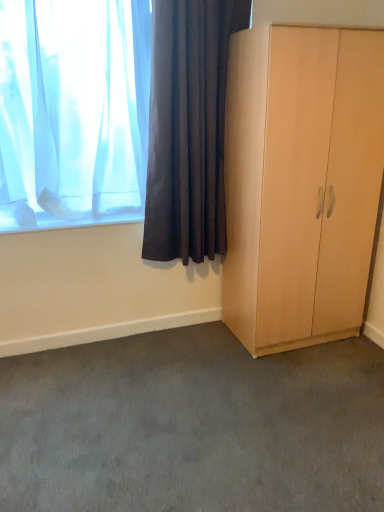
Image resolution: width=384 pixels, height=512 pixels. What are the coordinates of `translucent fabric curtain at upper left, which is the 2th curtain in right-to-left order` in the screenshot? It's located at (73, 111).

You are a GUI agent. You are given a task and a screenshot of the screen. Output one action in this format:
    pyautogui.click(x=<x>, y=<y>)
    Task: Click on the dark fabric curtain at upper left, which appears as the first curtain when viewed from the right
    The image size is (384, 512).
    Given the screenshot: What is the action you would take?
    pyautogui.click(x=188, y=128)

The height and width of the screenshot is (512, 384). In order to click on light wood wardrobe at right in this screenshot , I will do `click(301, 182)`.

Where is `translucent fabric curtain at upper left, positioned as the 1th curtain in left-to-right order`? The width and height of the screenshot is (384, 512). translucent fabric curtain at upper left, positioned as the 1th curtain in left-to-right order is located at coordinates (73, 111).

From a real-world perspective, is gray carpet at lower center positioned under light wood wardrobe at right based on gravity?

Yes, from a real-world perspective, gray carpet at lower center is beneath light wood wardrobe at right.

Can you confirm if gray carpet at lower center is bigger than light wood wardrobe at right?

Actually, gray carpet at lower center might be smaller than light wood wardrobe at right.

Consider the image. Does gray carpet at lower center turn towards light wood wardrobe at right?

No, gray carpet at lower center is not aimed at light wood wardrobe at right.

Considering the positions of points (110, 79) and (193, 105), is point (110, 79) closer to camera compared to point (193, 105)?

No, it is behind (193, 105).

Can you confirm if translucent fabric curtain at upper left, positioned as the 1th curtain in left-to-right order, is positioned to the right of dark fabric curtain at upper left, which appears as the first curtain when viewed from the right?

Incorrect, translucent fabric curtain at upper left, positioned as the 1th curtain in left-to-right order, is not on the right side of dark fabric curtain at upper left, which appears as the first curtain when viewed from the right.

From a real-world perspective, is translucent fabric curtain at upper left, which is the 2th curtain in right-to-left order, above or below dark fabric curtain at upper left, which appears as the first curtain when viewed from the right?

translucent fabric curtain at upper left, which is the 2th curtain in right-to-left order, is above dark fabric curtain at upper left, which appears as the first curtain when viewed from the right.

Would you say dark fabric curtain at upper left, which appears as the first curtain when viewed from the right, is part of translucent fabric curtain at upper left, positioned as the 1th curtain in left-to-right order,'s contents?

No, dark fabric curtain at upper left, which appears as the first curtain when viewed from the right, is not a part of translucent fabric curtain at upper left, positioned as the 1th curtain in left-to-right order.

From the image's perspective, is dark fabric curtain at upper left, which appears as the first curtain when viewed from the right, located above or below light wood wardrobe at right?

Based on their image positions, dark fabric curtain at upper left, which appears as the first curtain when viewed from the right, is located above light wood wardrobe at right.

Considering the positions of point (163, 169) and point (314, 74), is point (163, 169) closer or farther from the camera than point (314, 74)?

Clearly, point (163, 169) is more distant from the camera than point (314, 74).

Is dark fabric curtain at upper left, which appears as the first curtain when viewed from the right, not close to light wood wardrobe at right?

Actually, dark fabric curtain at upper left, which appears as the first curtain when viewed from the right, and light wood wardrobe at right are a little close together.

Can you confirm if translucent fabric curtain at upper left, positioned as the 1th curtain in left-to-right order, is positioned to the right of light wood wardrobe at right?

In fact, translucent fabric curtain at upper left, positioned as the 1th curtain in left-to-right order, is to the left of light wood wardrobe at right.

Are translucent fabric curtain at upper left, positioned as the 1th curtain in left-to-right order, and light wood wardrobe at right located far from each other?

That's not correct — translucent fabric curtain at upper left, positioned as the 1th curtain in left-to-right order, is a little close to light wood wardrobe at right.

From the picture: Can you confirm if translucent fabric curtain at upper left, positioned as the 1th curtain in left-to-right order, is thinner than light wood wardrobe at right?

Correct, the width of translucent fabric curtain at upper left, positioned as the 1th curtain in left-to-right order, is less than that of light wood wardrobe at right.

How many degrees apart are the facing directions of translucent fabric curtain at upper left, positioned as the 1th curtain in left-to-right order, and light wood wardrobe at right?

1.42 degrees separate the facing orientations of translucent fabric curtain at upper left, positioned as the 1th curtain in left-to-right order, and light wood wardrobe at right.

In the scene shown: Measure the distance from light wood wardrobe at right to dark fabric curtain at upper left, the second curtain in the left-to-right sequence.

light wood wardrobe at right is 17.49 inches from dark fabric curtain at upper left, the second curtain in the left-to-right sequence.

Can you confirm if light wood wardrobe at right is shorter than dark fabric curtain at upper left, which appears as the first curtain when viewed from the right?

No.

Looking at this image, could you tell me if light wood wardrobe at right is facing dark fabric curtain at upper left, which appears as the first curtain when viewed from the right?

No.

Does light wood wardrobe at right come behind dark fabric curtain at upper left, the second curtain in the left-to-right sequence?

No, it is in front of dark fabric curtain at upper left, the second curtain in the left-to-right sequence.

Which point is more forward, (345, 33) or (90, 22)?

Positioned in front is point (345, 33).

Consider the image. From the image's perspective, which is below, light wood wardrobe at right or translucent fabric curtain at upper left, positioned as the 1th curtain in left-to-right order?

From the image's view, light wood wardrobe at right is below.

Does light wood wardrobe at right turn towards translucent fabric curtain at upper left, which is the 2th curtain in right-to-left order?

No, light wood wardrobe at right does not turn towards translucent fabric curtain at upper left, which is the 2th curtain in right-to-left order.

Considering the relative sizes of light wood wardrobe at right and translucent fabric curtain at upper left, which is the 2th curtain in right-to-left order, in the image provided, is light wood wardrobe at right shorter than translucent fabric curtain at upper left, which is the 2th curtain in right-to-left order,?

In fact, light wood wardrobe at right may be taller than translucent fabric curtain at upper left, which is the 2th curtain in right-to-left order.

I want to click on plain below the dark fabric curtain at upper left, the second curtain in the left-to-right sequence (from the image's perspective), so point(193,426).

From the picture: From a real-world perspective, which is physically below, dark fabric curtain at upper left, the second curtain in the left-to-right sequence, or gray carpet at lower center?

From a 3D spatial view, gray carpet at lower center is below.

Between dark fabric curtain at upper left, the second curtain in the left-to-right sequence, and gray carpet at lower center, which one is positioned behind?

Positioned behind is dark fabric curtain at upper left, the second curtain in the left-to-right sequence.

This screenshot has height=512, width=384. What are the coordinates of `plain in front of the light wood wardrobe at right` in the screenshot? It's located at (193, 426).

You are a GUI agent. You are given a task and a screenshot of the screen. Output one action in this format:
    pyautogui.click(x=<x>, y=<y>)
    Task: Click on the curtain located below the translucent fabric curtain at upper left, which is the 2th curtain in right-to-left order (from the image's perspective)
    
    Given the screenshot: What is the action you would take?
    pyautogui.click(x=188, y=128)

Considering their positions, is translucent fabric curtain at upper left, positioned as the 1th curtain in left-to-right order, positioned closer to gray carpet at lower center than dark fabric curtain at upper left, which appears as the first curtain when viewed from the right?

The object closer to gray carpet at lower center is dark fabric curtain at upper left, which appears as the first curtain when viewed from the right.

Considering their positions, is dark fabric curtain at upper left, which appears as the first curtain when viewed from the right, positioned closer to translucent fabric curtain at upper left, which is the 2th curtain in right-to-left order, than gray carpet at lower center?

The object closer to translucent fabric curtain at upper left, which is the 2th curtain in right-to-left order, is dark fabric curtain at upper left, which appears as the first curtain when viewed from the right.

Looking at the image, which one is located further to dark fabric curtain at upper left, which appears as the first curtain when viewed from the right, gray carpet at lower center or translucent fabric curtain at upper left, positioned as the 1th curtain in left-to-right order?

The object further to dark fabric curtain at upper left, which appears as the first curtain when viewed from the right, is gray carpet at lower center.

Looking at the image, which one is located closer to light wood wardrobe at right, dark fabric curtain at upper left, which appears as the first curtain when viewed from the right, or translucent fabric curtain at upper left, positioned as the 1th curtain in left-to-right order?

dark fabric curtain at upper left, which appears as the first curtain when viewed from the right, is closer to light wood wardrobe at right.

When comparing their distances from translucent fabric curtain at upper left, which is the 2th curtain in right-to-left order, does gray carpet at lower center or dark fabric curtain at upper left, the second curtain in the left-to-right sequence, seem closer?

dark fabric curtain at upper left, the second curtain in the left-to-right sequence.

Based on their spatial positions, is light wood wardrobe at right or gray carpet at lower center closer to translucent fabric curtain at upper left, which is the 2th curtain in right-to-left order?

The object closer to translucent fabric curtain at upper left, which is the 2th curtain in right-to-left order, is light wood wardrobe at right.

From the image, which object appears to be nearer to gray carpet at lower center, light wood wardrobe at right or translucent fabric curtain at upper left, positioned as the 1th curtain in left-to-right order?

light wood wardrobe at right lies closer to gray carpet at lower center than the other object.

Which object lies nearer to the anchor point gray carpet at lower center, translucent fabric curtain at upper left, positioned as the 1th curtain in left-to-right order, or light wood wardrobe at right?

light wood wardrobe at right.

The height and width of the screenshot is (512, 384). Identify the location of curtain that lies between translucent fabric curtain at upper left, positioned as the 1th curtain in left-to-right order, and gray carpet at lower center from top to bottom. (188, 128).

The height and width of the screenshot is (512, 384). Find the location of `cabinetry between dark fabric curtain at upper left, the second curtain in the left-to-right sequence, and gray carpet at lower center in the up-down direction`. cabinetry between dark fabric curtain at upper left, the second curtain in the left-to-right sequence, and gray carpet at lower center in the up-down direction is located at coordinates (301, 182).

The width and height of the screenshot is (384, 512). What are the coordinates of `curtain between translucent fabric curtain at upper left, which is the 2th curtain in right-to-left order, and light wood wardrobe at right from left to right` in the screenshot? It's located at (188, 128).

At what (x,y) coordinates should I click in order to perform the action: click on cabinetry between translucent fabric curtain at upper left, positioned as the 1th curtain in left-to-right order, and gray carpet at lower center from top to bottom. Please return your answer as a coordinate pair (x, y). Looking at the image, I should click on (301, 182).